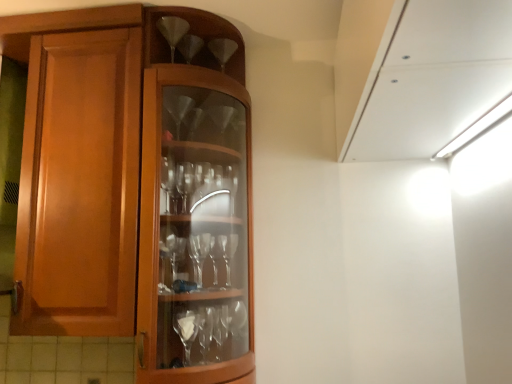
Question: Are clear glass wine glass at upper center, placed as the 1th wine glass when sorted from left to right, and clear glass wine glass at upper center, positioned as the second wine glass in left-to-right order, making contact?

Choices:
 (A) yes
 (B) no

Answer: (B)

Question: From a real-world perspective, does clear glass wine glass at upper center, the second wine glass when ordered from back to front, sit lower than clear glass wine glass at upper center, which ranks as the first wine glass in back-to-front order?

Choices:
 (A) yes
 (B) no

Answer: (B)

Question: Is clear glass wine glass at upper center, the second wine glass when ordered from back to front, to the right of clear glass wine glass at upper center, acting as the second wine glass starting from the front, from the viewer's perspective?

Choices:
 (A) no
 (B) yes

Answer: (A)

Question: From the image's perspective, is clear glass wine glass at upper center, the first wine glass positioned from the front, beneath clear glass wine glass at upper center, acting as the second wine glass starting from the front?

Choices:
 (A) no
 (B) yes

Answer: (A)

Question: Considering the relative sizes of clear glass wine glass at upper center, which appears as the second wine glass when viewed from the right, and clear glass wine glass at upper center, the first wine glass viewed from the right, in the image provided, is clear glass wine glass at upper center, which appears as the second wine glass when viewed from the right, thinner than clear glass wine glass at upper center, the first wine glass viewed from the right,?

Choices:
 (A) no
 (B) yes

Answer: (B)

Question: Is clear glass wine glass at upper center, placed as the 1th wine glass when sorted from left to right, bigger than clear glass wine glass at upper center, which ranks as the first wine glass in back-to-front order?

Choices:
 (A) yes
 (B) no

Answer: (B)

Question: Is clear glass wine glass at upper center, the first wine glass viewed from the right, not inside clear glass wine glass at upper center, the first wine glass positioned from the front?

Choices:
 (A) no
 (B) yes

Answer: (B)

Question: From the image's perspective, is clear glass wine glass at upper center, positioned as the second wine glass in left-to-right order, above clear glass wine glass at upper center, placed as the 1th wine glass when sorted from left to right?

Choices:
 (A) yes
 (B) no

Answer: (B)

Question: From a real-world perspective, is clear glass wine glass at upper center, positioned as the second wine glass in left-to-right order, beneath clear glass wine glass at upper center, the first wine glass positioned from the front?

Choices:
 (A) no
 (B) yes

Answer: (B)

Question: Considering the relative sizes of clear glass wine glass at upper center, positioned as the second wine glass in left-to-right order, and clear glass wine glass at upper center, placed as the 1th wine glass when sorted from left to right, in the image provided, is clear glass wine glass at upper center, positioned as the second wine glass in left-to-right order, smaller than clear glass wine glass at upper center, placed as the 1th wine glass when sorted from left to right,?

Choices:
 (A) yes
 (B) no

Answer: (B)

Question: Would you say clear glass wine glass at upper center, which ranks as the first wine glass in back-to-front order, contains clear glass wine glass at upper center, which appears as the second wine glass when viewed from the right?

Choices:
 (A) yes
 (B) no

Answer: (B)

Question: Could you tell me if clear glass wine glass at upper center, the first wine glass viewed from the right, is facing clear glass wine glass at upper center, placed as the 1th wine glass when sorted from left to right?

Choices:
 (A) no
 (B) yes

Answer: (A)

Question: Is clear glass wine glass at upper center, acting as the second wine glass starting from the front, in front of or behind clear glass wine glass at upper center, which appears as the second wine glass when viewed from the right, in the image?

Choices:
 (A) front
 (B) behind

Answer: (B)